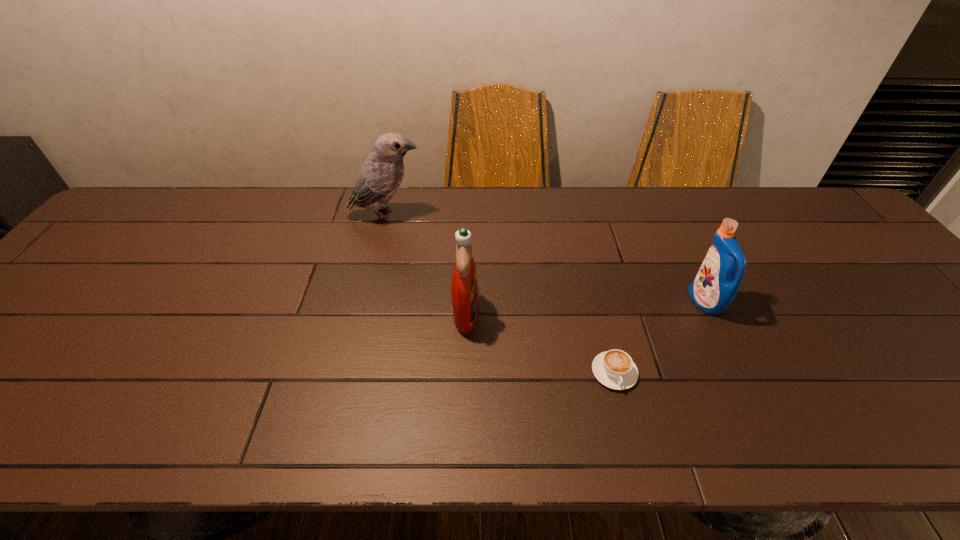
At what (x,y) coordinates should I click in order to perform the action: click on vacant area in the image that satisfies the following two spatial constraints: 1. on the label of the right detergent; 2. on the side of the shortest object with the handle. Please return your answer as a coordinate pair (x, y). This screenshot has width=960, height=540. Looking at the image, I should click on (x=739, y=372).